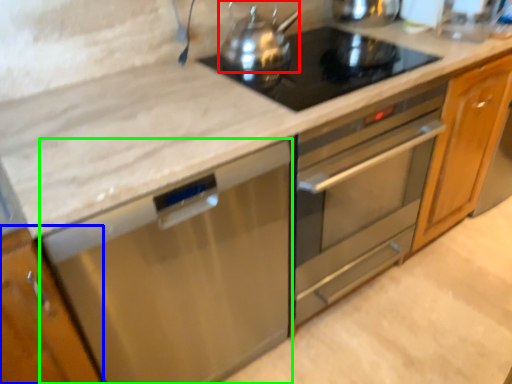
Question: Based on their relative distances, which object is nearer to kitchen appliance (highlighted by a red box)? Choose from cabinetry (highlighted by a blue box) and dish washer (highlighted by a green box).

Choices:
 (A) cabinetry
 (B) dish washer

Answer: (B)